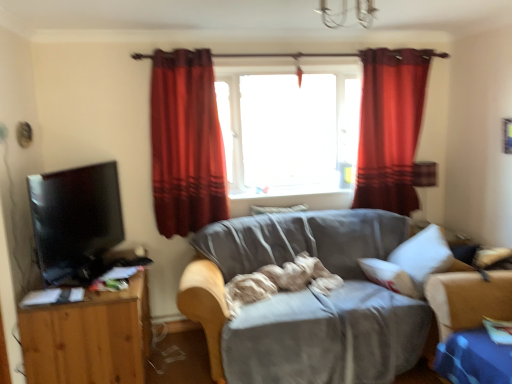
Question: Can you confirm if red velvet curtain at upper center, the 2th curtain viewed from the left, is smaller than velvet red curtain at center, which is the 1th curtain from left to right?

Choices:
 (A) yes
 (B) no

Answer: (B)

Question: Is red velvet curtain at upper center, the 2th curtain viewed from the left, not within velvet red curtain at center, which appears as the 2th curtain when viewed from the right?

Choices:
 (A) yes
 (B) no

Answer: (A)

Question: Is the position of red velvet curtain at upper center, placed as the 1th curtain when sorted from right to left, more distant than that of velvet red curtain at center, which appears as the 2th curtain when viewed from the right?

Choices:
 (A) yes
 (B) no

Answer: (A)

Question: Is red velvet curtain at upper center, placed as the 1th curtain when sorted from right to left, touching velvet red curtain at center, which appears as the 2th curtain when viewed from the right?

Choices:
 (A) yes
 (B) no

Answer: (B)

Question: Does red velvet curtain at upper center, the 2th curtain viewed from the left, have a greater width compared to velvet red curtain at center, which appears as the 2th curtain when viewed from the right?

Choices:
 (A) no
 (B) yes

Answer: (A)

Question: Is velvet red curtain at center, which is the 1th curtain from left to right, wider or thinner than gray fabric couch at center?

Choices:
 (A) thin
 (B) wide

Answer: (A)

Question: Is velvet red curtain at center, which is the 1th curtain from left to right, inside the boundaries of gray fabric couch at center, or outside?

Choices:
 (A) inside
 (B) outside

Answer: (B)

Question: Considering the positions of velvet red curtain at center, which appears as the 2th curtain when viewed from the right, and gray fabric couch at center in the image, is velvet red curtain at center, which appears as the 2th curtain when viewed from the right, bigger or smaller than gray fabric couch at center?

Choices:
 (A) small
 (B) big

Answer: (A)

Question: From the image's perspective, is velvet red curtain at center, which is the 1th curtain from left to right, above or below gray fabric couch at center?

Choices:
 (A) below
 (B) above

Answer: (B)

Question: From the image's perspective, is wooden tv stand at left located above or below red velvet curtain at upper center, the 2th curtain viewed from the left?

Choices:
 (A) above
 (B) below

Answer: (B)

Question: Considering the positions of wooden tv stand at left and red velvet curtain at upper center, placed as the 1th curtain when sorted from right to left, in the image, is wooden tv stand at left bigger or smaller than red velvet curtain at upper center, placed as the 1th curtain when sorted from right to left,?

Choices:
 (A) big
 (B) small

Answer: (A)

Question: Looking at their shapes, would you say wooden tv stand at left is wider or thinner than red velvet curtain at upper center, placed as the 1th curtain when sorted from right to left?

Choices:
 (A) thin
 (B) wide

Answer: (B)

Question: Is wooden tv stand at left in front of or behind red velvet curtain at upper center, placed as the 1th curtain when sorted from right to left, in the image?

Choices:
 (A) behind
 (B) front

Answer: (B)

Question: Does point (394, 142) appear closer or farther from the camera than point (184, 210)?

Choices:
 (A) closer
 (B) farther

Answer: (B)

Question: Looking at their shapes, would you say red velvet curtain at upper center, the 2th curtain viewed from the left, is wider or thinner than velvet red curtain at center, which is the 1th curtain from left to right?

Choices:
 (A) wide
 (B) thin

Answer: (B)